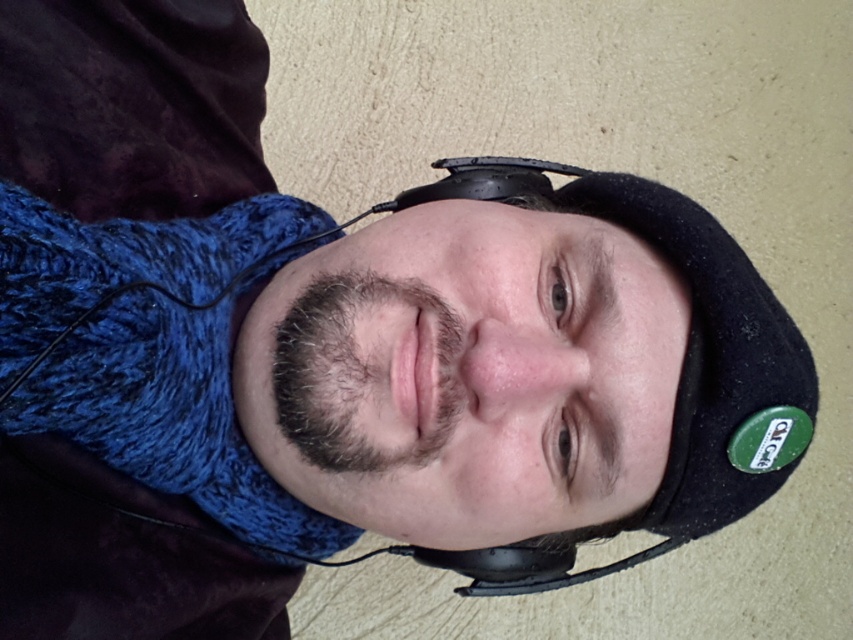
Question: Does black felt hat at center have a larger size compared to dark brown fuzzy beard at center?

Choices:
 (A) no
 (B) yes

Answer: (B)

Question: Which point is farther to the camera?

Choices:
 (A) (720, 298)
 (B) (350, 326)
 (C) (468, 172)

Answer: (C)

Question: Can you confirm if black felt hat at center is positioned above dark brown fuzzy beard at center?

Choices:
 (A) yes
 (B) no

Answer: (B)

Question: Which object appears closest to the camera in this image?

Choices:
 (A) dark brown fuzzy beard at center
 (B) black matte headphones at center
 (C) black felt hat at center

Answer: (A)

Question: Which of the following is the farthest from the observer?

Choices:
 (A) dark brown fuzzy beard at center
 (B) black felt hat at center
 (C) black matte headphones at center

Answer: (C)

Question: Can you confirm if dark brown fuzzy beard at center is positioned to the left of black matte headphones at center?

Choices:
 (A) yes
 (B) no

Answer: (A)